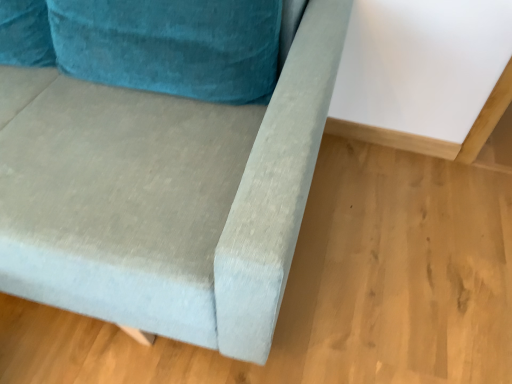
The height and width of the screenshot is (384, 512). What do you see at coordinates (164, 196) in the screenshot?
I see `velvet blue couch at center` at bounding box center [164, 196].

At what (x,y) coordinates should I click in order to perform the action: click on velvet blue couch at center. Please return your answer as a coordinate pair (x, y). This screenshot has width=512, height=384. Looking at the image, I should click on (164, 196).

Locate an element on the screen. velvet blue couch at center is located at coordinates (164, 196).